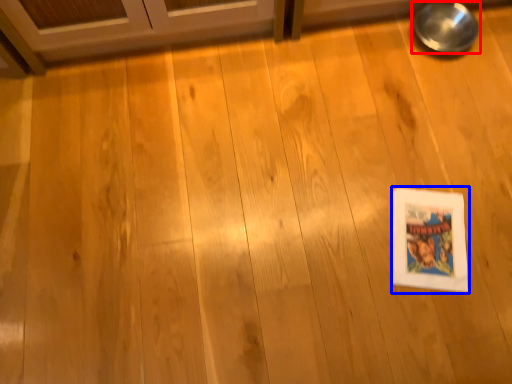
Question: Which object appears closest to the camera in this image, bowl (highlighted by a red box) or comic book (highlighted by a blue box)?

Choices:
 (A) bowl
 (B) comic book

Answer: (B)